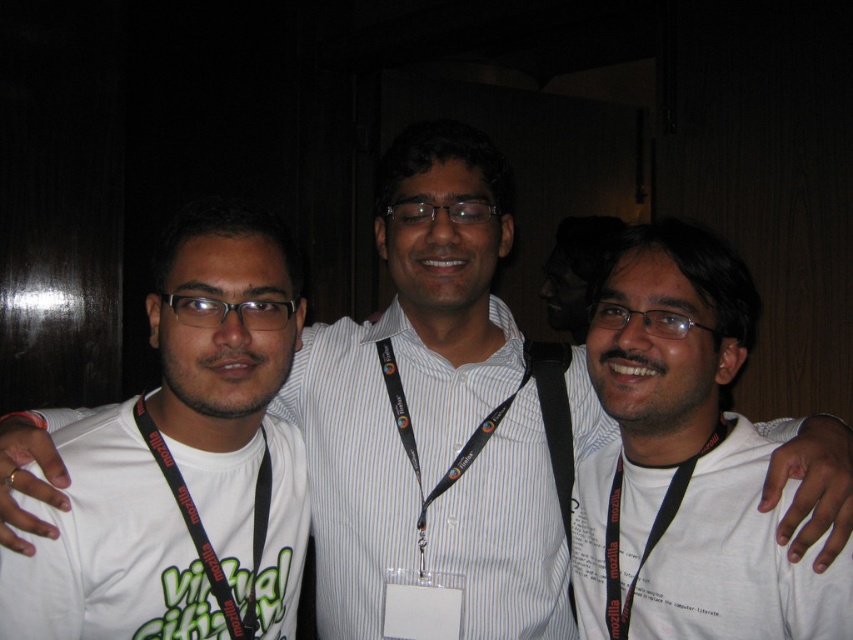
Question: Is white matte t-shirt at left positioned in front of black fabric lanyard at center?

Choices:
 (A) no
 (B) yes

Answer: (B)

Question: Which point appears farthest from the camera in this image?

Choices:
 (A) (202, 230)
 (B) (733, 460)

Answer: (A)

Question: Which of the following is the farthest from the observer?

Choices:
 (A) black fabric lanyard at center
 (B) white matte t-shirt at center
 (C) black fabric lanyard at left
 (D) white matte t-shirt at left

Answer: (A)

Question: Is white matte t-shirt at left in front of black fabric lanyard at left?

Choices:
 (A) yes
 (B) no

Answer: (A)

Question: Which of the following is the farthest from the observer?

Choices:
 (A) (13, 621)
 (B) (589, 499)

Answer: (B)

Question: Observing the image, what is the correct spatial positioning of white matte t-shirt at center in reference to black fabric lanyard at center?

Choices:
 (A) above
 (B) below

Answer: (A)